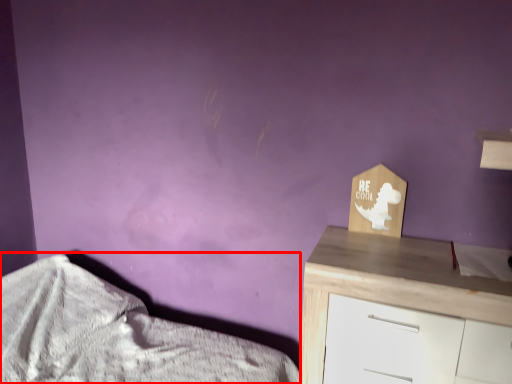
Question: From the image's perspective, where is bed (annotated by the red box) located in relation to chest of drawers in the image?

Choices:
 (A) above
 (B) below

Answer: (B)